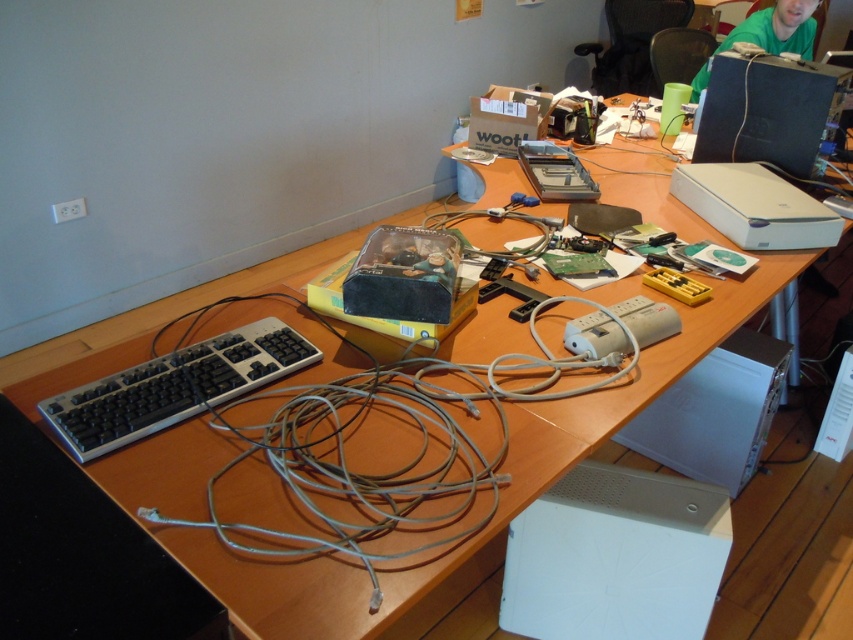
In the scene shown: Measure the distance between black plastic keyboard at left and white plastic computer tower at lower right.

black plastic keyboard at left and white plastic computer tower at lower right are 4.48 feet apart.

How much distance is there between black plastic keyboard at left and white plastic computer tower at lower right?

black plastic keyboard at left is 4.48 feet from white plastic computer tower at lower right.

Is point (62, 420) more distant than point (753, 461)?

No, it is not.

At what (x,y) coordinates should I click in order to perform the action: click on black plastic keyboard at left. Please return your answer as a coordinate pair (x, y). Looking at the image, I should click on (173, 387).

Between black plastic keyboard at left and black plastic desktop computer at upper right, which one is positioned higher?

black plastic desktop computer at upper right is higher up.

Can you confirm if black plastic keyboard at left is positioned to the right of black plastic desktop computer at upper right?

No, black plastic keyboard at left is not to the right of black plastic desktop computer at upper right.

This screenshot has width=853, height=640. In order to click on black plastic keyboard at left in this screenshot , I will do `click(173, 387)`.

Can you confirm if white plastic computer tower at lower right is positioned below black plastic desktop computer at upper right?

Correct, white plastic computer tower at lower right is located below black plastic desktop computer at upper right.

Does point (746, 422) come behind point (799, 140)?

Yes, it is.

You are a GUI agent. You are given a task and a screenshot of the screen. Output one action in this format:
    pyautogui.click(x=<x>, y=<y>)
    Task: Click on the white plastic computer tower at lower right
    This screenshot has height=640, width=853.
    Given the screenshot: What is the action you would take?
    pyautogui.click(x=715, y=412)